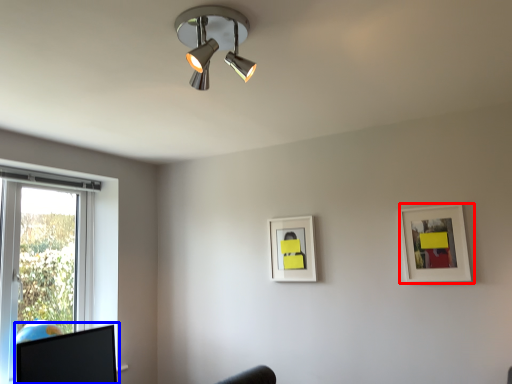
Question: Which point is closer to the camera, picture frame (highlighted by a red box) or computer monitor (highlighted by a blue box)?

Choices:
 (A) picture frame
 (B) computer monitor

Answer: (B)